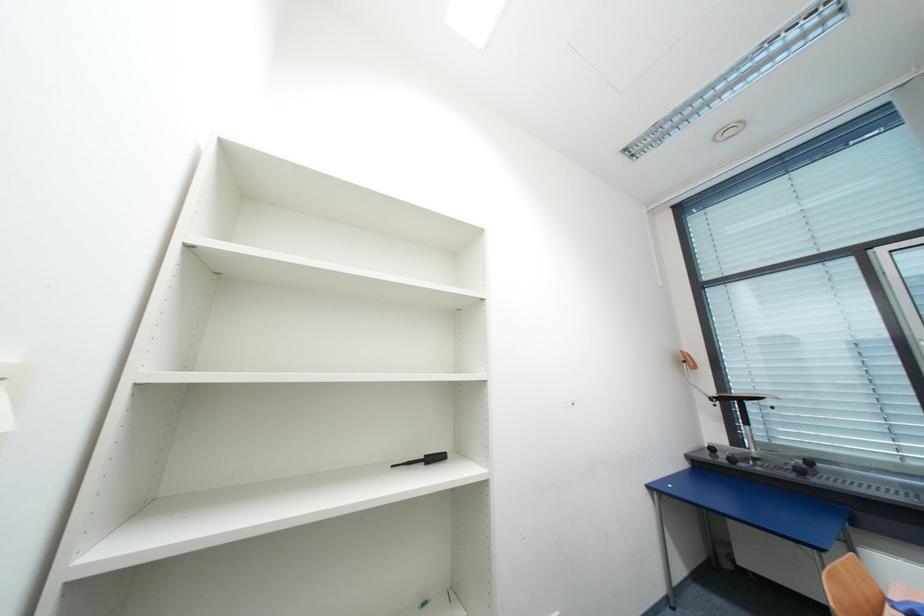
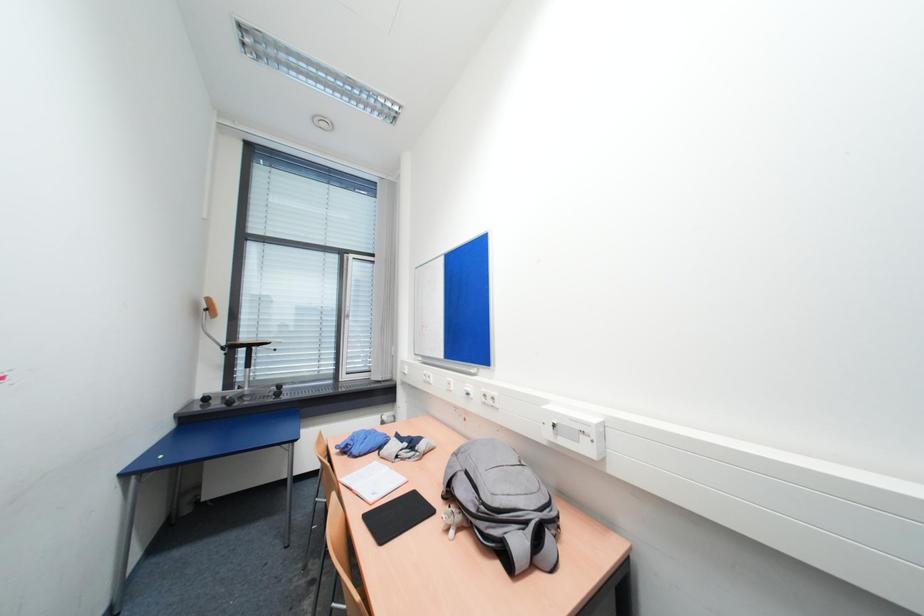
Question: The camera is either moving clockwise (left) or counter-clockwise (right) around the object. The first image is from the beginning of the video and the second image is from the end. Is the camera moving left or right when shooting the video?

Choices:
 (A) Left
 (B) Right

Answer: (A)